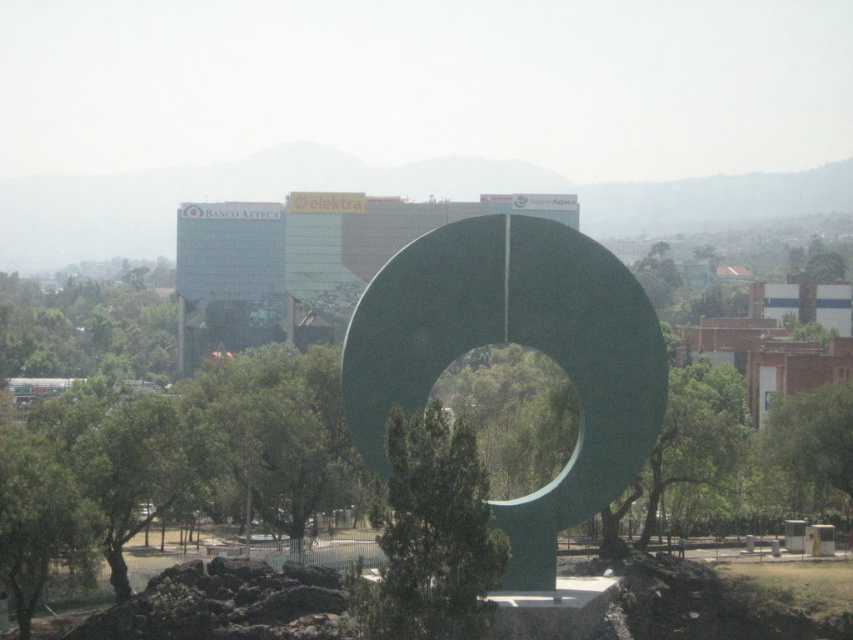
Question: Observing the image, what is the correct spatial positioning of green matte tree at center in reference to green leafy tree at center?

Choices:
 (A) left
 (B) right

Answer: (A)

Question: Is green polished stone sculpture at center positioned behind green matte tree at center?

Choices:
 (A) yes
 (B) no

Answer: (A)

Question: Which of the following is the closest to the observer?

Choices:
 (A) green polished stone circle at center
 (B) green polished stone sculpture at center
 (C) green matte tree at center
 (D) green leafy tree at center

Answer: (C)

Question: Does green polished stone circle at center have a greater width compared to green leafy tree at center?

Choices:
 (A) yes
 (B) no

Answer: (A)

Question: Which point is farther to the camera?

Choices:
 (A) (828, 392)
 (B) (107, 448)
 (C) (604, 276)

Answer: (A)

Question: Estimate the real-world distances between objects in this image. Which object is farther from the green polished stone circle at center?

Choices:
 (A) green matte tree at center
 (B) green leafy tree at center
 (C) green polished stone sculpture at center

Answer: (B)